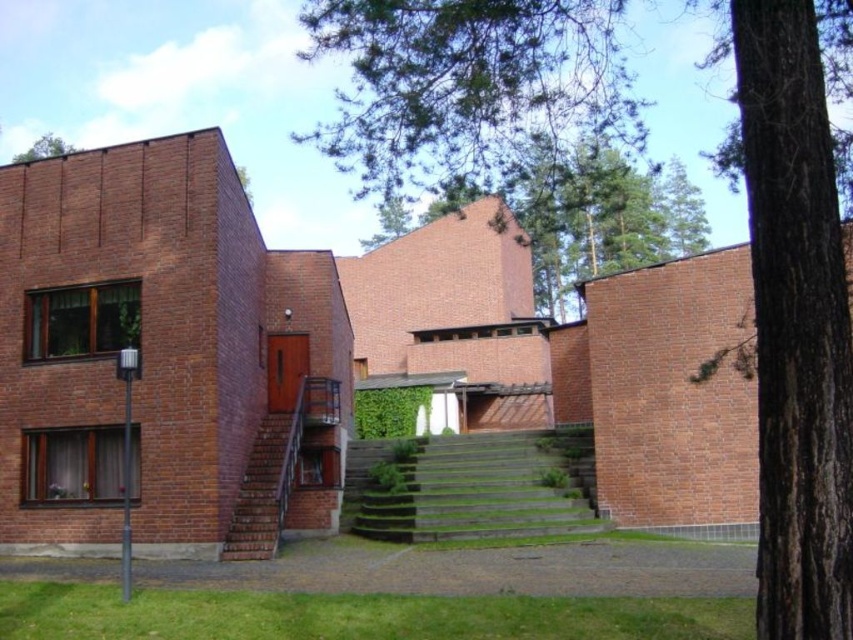
You are standing in front of the modern architectural structure and want to enter through the wooden door. Which set of stairs should you use to reach the door, the green concrete stairs at center or the brick stairs at lower left?

The green concrete stairs at center are closer to you since they are further to the viewer than the brick stairs at lower left, so you should use the green concrete stairs at center to reach the wooden door.

You are standing at the point labeled as point (486, 488) in the image, which is at the center. You want to reach the wooden door on the left side of the building. Which direction should you move relative to the green concrete stairs at center?

The point (486, 488) is the green concrete stairs at center. To reach the wooden door on the left side of the building, you should move towards the left relative to the green concrete stairs at center.

You are standing at the entrance of the building and want to reach the point marked as point (495, 483). Which direction should you move relative to point (398, 42)?

To reach point (495, 483), you should move behind point (398, 42) since point (398, 42) is in front of point (495, 483).